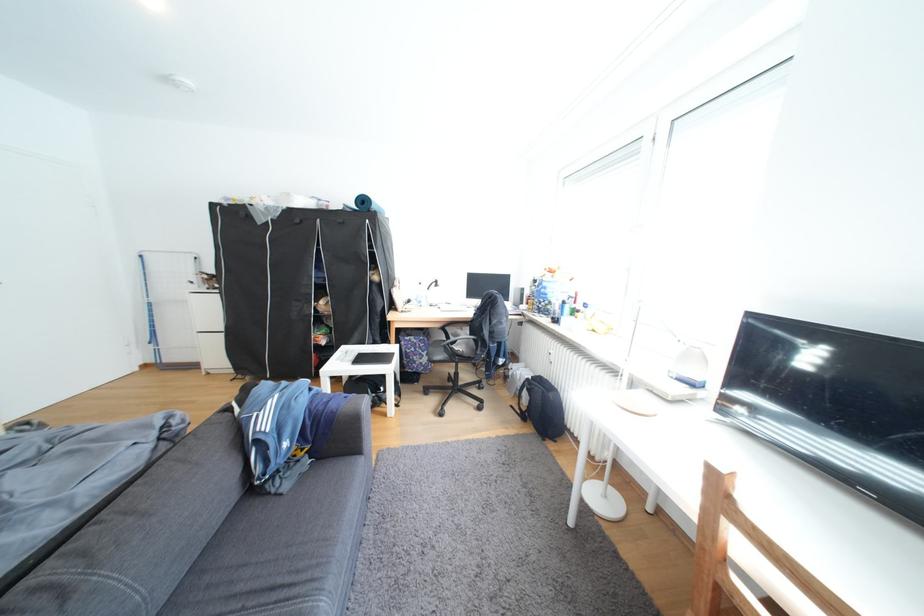
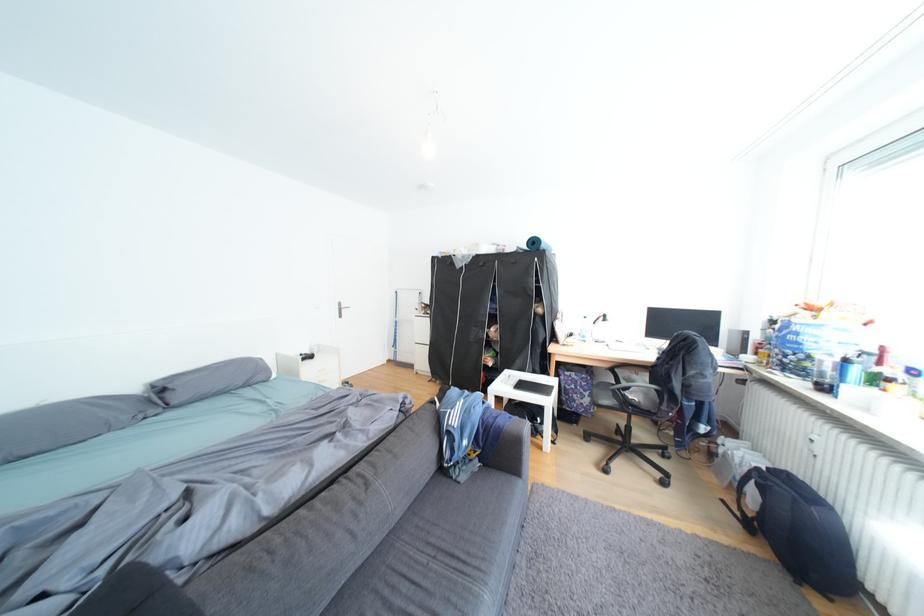
Locate, in the second image, the point that corresponds to pixel 427 302 in the first image.

(590, 337)